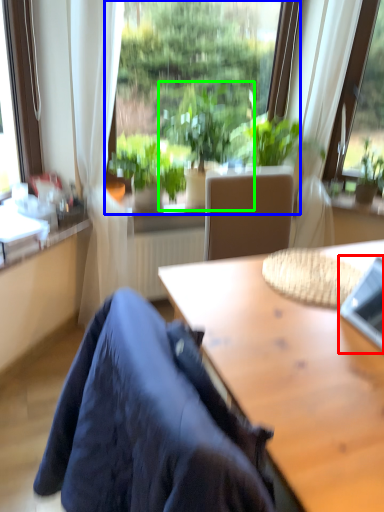
Question: Considering the real-world distances, which object is farthest from laptop (highlighted by a red box)? window (highlighted by a blue box) or houseplant (highlighted by a green box)?

Choices:
 (A) window
 (B) houseplant

Answer: (A)